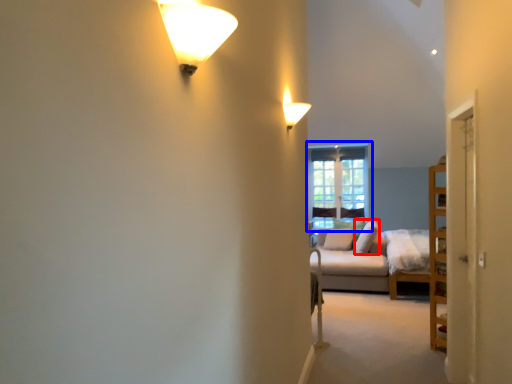
Question: Which of the following is the closest to the observer, pillow (highlighted by a red box) or window (highlighted by a blue box)?

Choices:
 (A) pillow
 (B) window

Answer: (A)